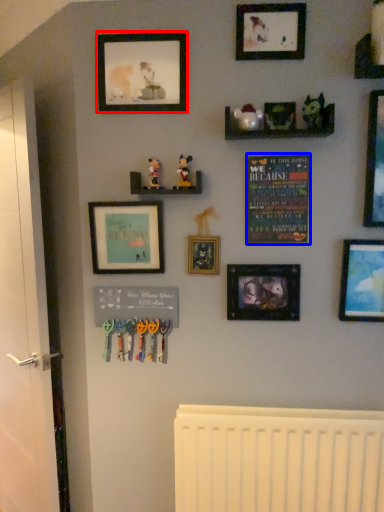
Question: Which object is closer to the camera taking this photo, picture frame (highlighted by a red box) or bulletin board (highlighted by a blue box)?

Choices:
 (A) picture frame
 (B) bulletin board

Answer: (A)